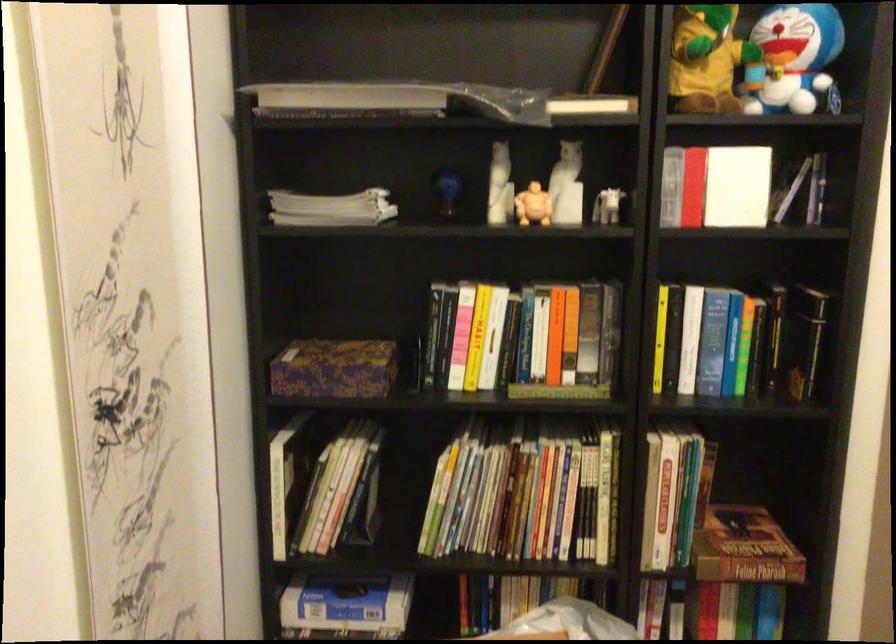
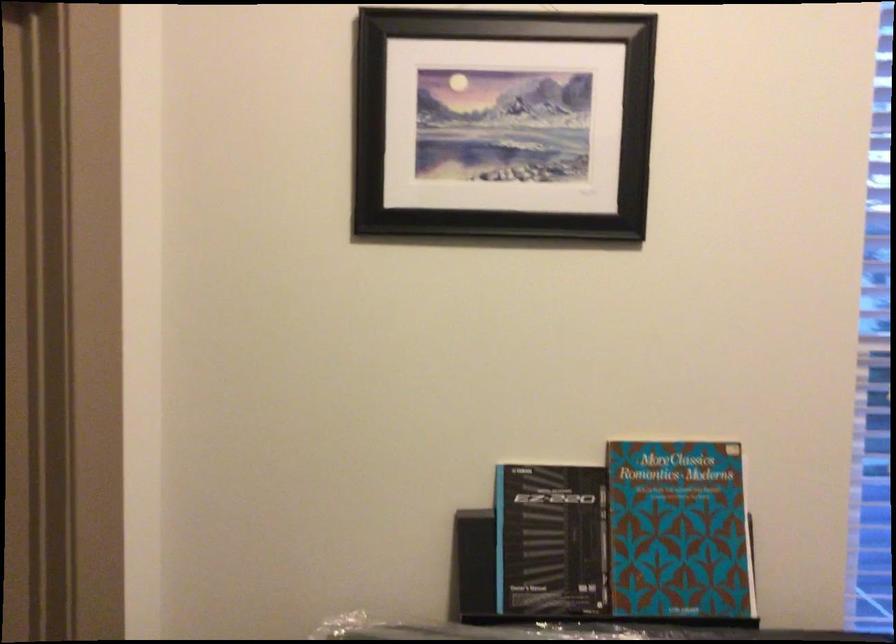
Question: The images are taken continuously from a first-person perspective. In which direction is your viewpoint rotating?

Choices:
 (A) Left
 (B) Right
 (C) Up
 (D) Down

Answer: (B)